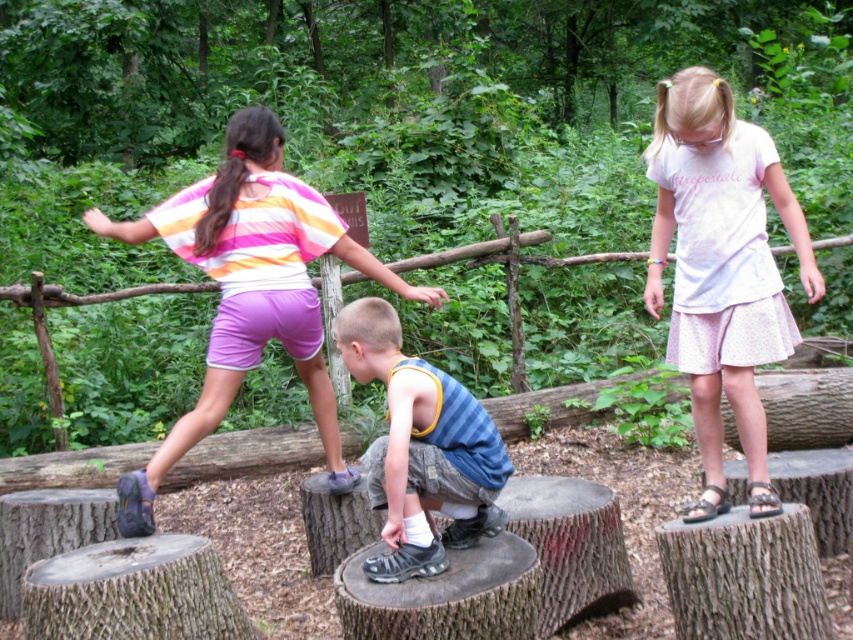
You are a photographer trying to capture a candid shot of the children in the forest. You want to ensure that both the matte pink shorts at left and the blue striped tank top at center are visible in your frame. Based on their positions, which object should you focus on first to include both in the shot?

Since the matte pink shorts at left is positioned on the left side of blue striped tank top at center, you should focus on the blue striped tank top at center first to ensure both are within the frame.

You are a photographer trying to capture a candid shot of the children in the forest. You notice the matte pink shorts at left and the blue striped tank top at center. Which object is closer to your camera lens?

The matte pink shorts at left are closer to the camera lens because they are further to the viewer than the blue striped tank top at center.

In the forest scene with children playing around tree stumps, there is a pale pink fabric skirt at center and a blue striped tank top at center. From the perspective of someone standing at the edge of the wood chip ground, which clothing item is positioned more to the east?

The pale pink fabric skirt at center is to the right of the blue striped tank top at center, so from the observer at the edge of the wood chip ground, the pale pink fabric skirt at center is positioned more to the east.